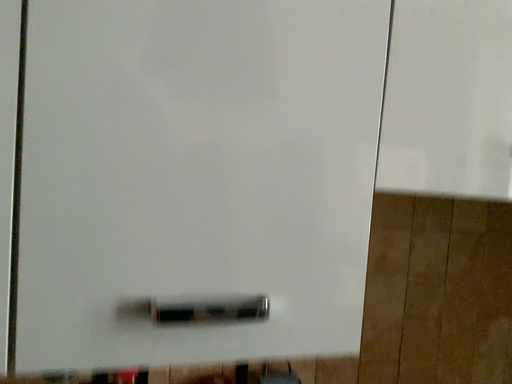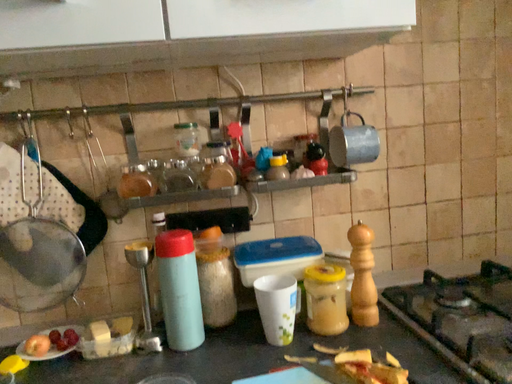
Question: Which way did the camera rotate in the video?

Choices:
 (A) rotated right
 (B) rotated left

Answer: (B)